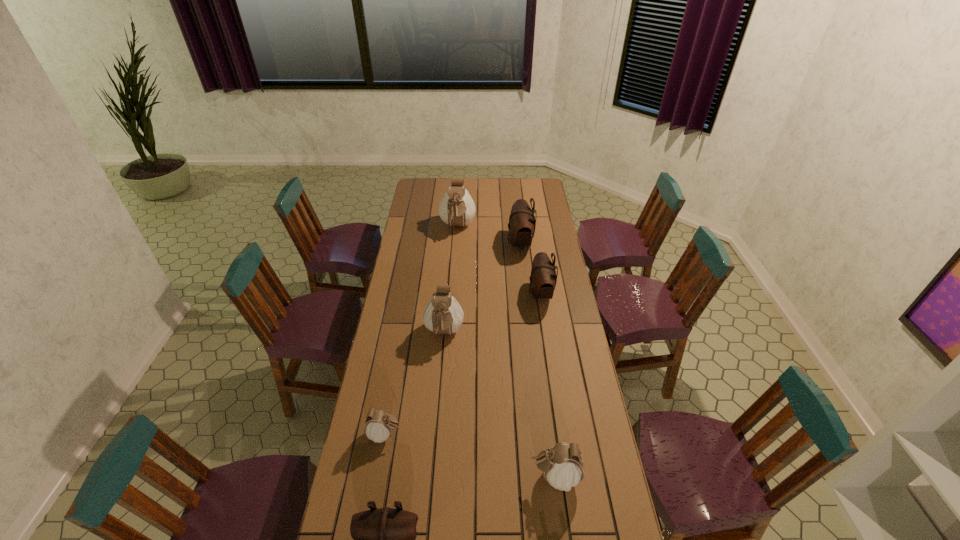
Locate an element on the screen. The height and width of the screenshot is (540, 960). vacant area located on the front-facing side of the farthest white pouch is located at coordinates (454, 281).

Identify the location of free space located 0.240m with the flap open on the farthest brown pouch. (463, 243).

Locate an element on the screen. The image size is (960, 540). blank space located with the flap open on the farthest brown pouch is located at coordinates (465, 243).

Where is `vacant space located 0.200m with the flap open on the farthest brown pouch`? vacant space located 0.200m with the flap open on the farthest brown pouch is located at coordinates (469, 243).

Find the location of a particular element. The image size is (960, 540). vacant position located 0.160m on the front-facing side of the fourth farthest object is located at coordinates (440, 384).

At what (x,y) coordinates should I click in order to perform the action: click on vacant region located with the flap open on the second nearest brown pouch. Please return your answer as a coordinate pair (x, y). Looking at the image, I should click on (465, 293).

At what (x,y) coordinates should I click in order to perform the action: click on vacant area situated with the flap open on the second nearest brown pouch. Please return your answer as a coordinate pair (x, y). Looking at the image, I should click on (458, 293).

Where is `vacant area situated with the flap open on the second nearest brown pouch`? vacant area situated with the flap open on the second nearest brown pouch is located at coordinates (492, 293).

You are a GUI agent. You are given a task and a screenshot of the screen. Output one action in this format:
    pyautogui.click(x=<x>, y=<y>)
    Task: Click on the free space located 0.220m on the front-facing side of the second nearest object
    
    Given the screenshot: What is the action you would take?
    pyautogui.click(x=462, y=476)

Locate an element on the screen. This screenshot has height=540, width=960. vacant area located on the front-facing side of the second nearest object is located at coordinates (431, 476).